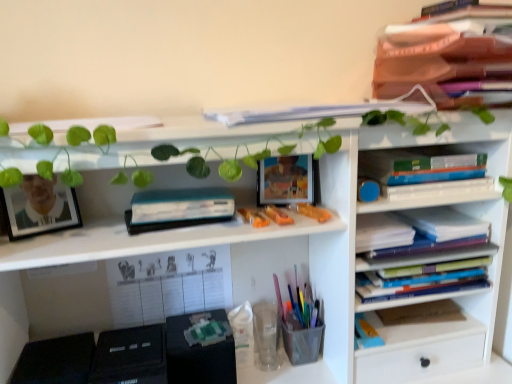
Question: From the image's perspective, is white paper calendar at center, which is the 2th book in bottom-to-top order, over blue hardcover book at center right, which ranks as the sixth book in bottom-to-top order?

Choices:
 (A) no
 (B) yes

Answer: (A)

Question: Would you say white paper calendar at center, which is the 2th book in bottom-to-top order, is outside blue hardcover book at center right, which ranks as the sixth book in bottom-to-top order?

Choices:
 (A) yes
 (B) no

Answer: (A)

Question: Would you say blue hardcover book at center right, which ranks as the sixth book in bottom-to-top order, is part of white paper calendar at center, which appears as the 8th book when viewed from the top,'s contents?

Choices:
 (A) no
 (B) yes

Answer: (A)

Question: From the image's perspective, would you say white paper calendar at center, which is the 2th book in bottom-to-top order, is shown under blue hardcover book at center right, the 4th book when ordered from top to bottom?

Choices:
 (A) yes
 (B) no

Answer: (A)

Question: Can you confirm if white paper calendar at center, which appears as the 8th book when viewed from the top, is smaller than blue hardcover book at center right, the 4th book when ordered from top to bottom?

Choices:
 (A) yes
 (B) no

Answer: (B)

Question: From a real-world perspective, does white paper calendar at center, which is the 2th book in bottom-to-top order, sit lower than blue hardcover book at center right, which ranks as the sixth book in bottom-to-top order?

Choices:
 (A) yes
 (B) no

Answer: (A)

Question: Does blue hardcover book at right, acting as the 5th book starting from the top, lie behind translucent plastic toy at upper center?

Choices:
 (A) yes
 (B) no

Answer: (A)

Question: Considering the relative sizes of blue hardcover book at right, which ranks as the fifth book in bottom-to-top order, and translucent plastic toy at upper center in the image provided, is blue hardcover book at right, which ranks as the fifth book in bottom-to-top order, wider than translucent plastic toy at upper center?

Choices:
 (A) no
 (B) yes

Answer: (B)

Question: From the image's perspective, would you say blue hardcover book at right, which ranks as the fifth book in bottom-to-top order, is positioned over translucent plastic toy at upper center?

Choices:
 (A) yes
 (B) no

Answer: (B)

Question: Does blue hardcover book at right, acting as the 5th book starting from the top, have a lesser width compared to translucent plastic toy at upper center?

Choices:
 (A) no
 (B) yes

Answer: (A)

Question: Does blue hardcover book at right, acting as the 5th book starting from the top, have a smaller size compared to translucent plastic toy at upper center?

Choices:
 (A) no
 (B) yes

Answer: (A)

Question: Is blue hardcover book at right, acting as the 5th book starting from the top, facing towards translucent plastic toy at upper center?

Choices:
 (A) yes
 (B) no

Answer: (B)

Question: From a real-world perspective, is translucent plastic toy at upper center located higher than matte orange book at upper right, which is the first book in top-to-bottom order?

Choices:
 (A) no
 (B) yes

Answer: (A)